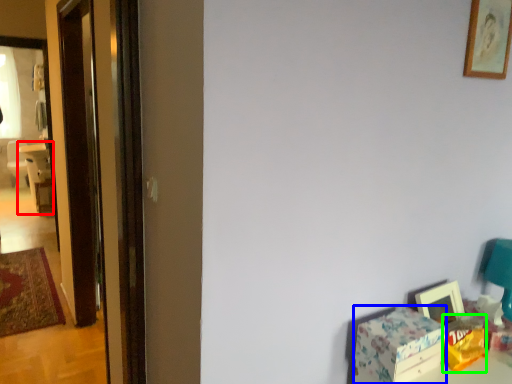
Question: Which object is positioned farthest from chair (highlighted by a red box)? Select from box (highlighted by a blue box) and box (highlighted by a green box).

Choices:
 (A) box
 (B) box

Answer: (B)